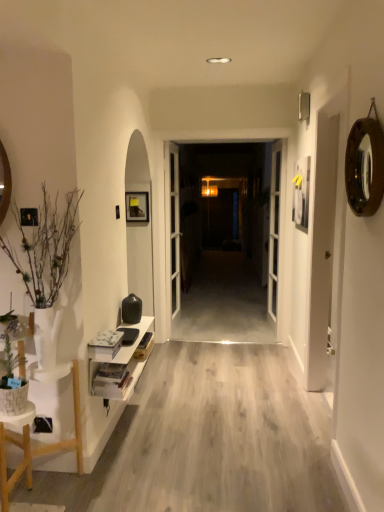
Locate an element on the screen. This screenshot has height=512, width=384. vacant space underneath white glossy shelf at lower left (from a real-world perspective) is located at coordinates (124, 430).